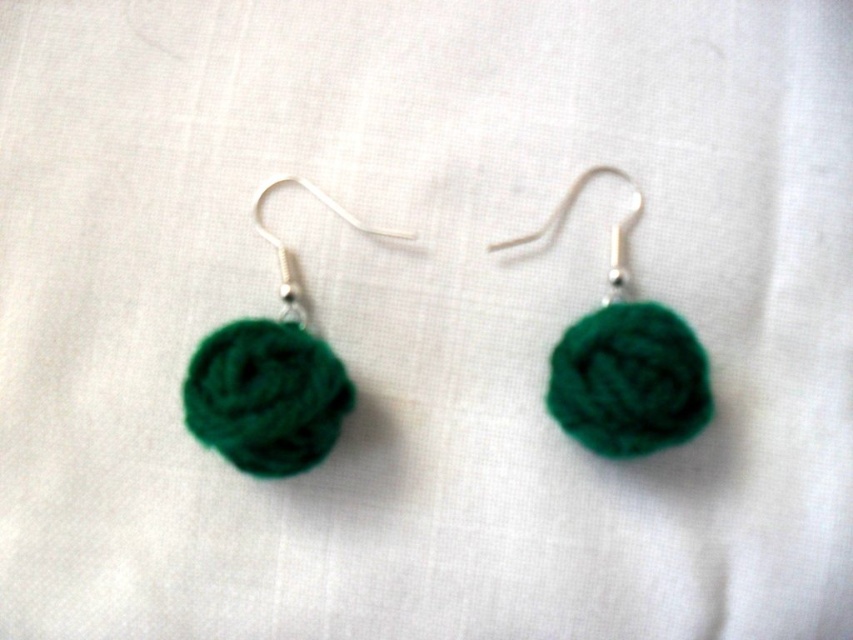
You are a jewelry designer who wants to place both the emerald green felt ball at left and the green fuzzy ball at center onto a display board. The display board has a maximum width of 30 centimeters. Can both items fit side by side on the board without overlapping?

The emerald green felt ball at left and green fuzzy ball at center are 35.72 centimeters apart. Since the distance between them is greater than the display board width of 30 centimeters, they cannot fit side by side without overlapping.

You are a jewelry designer who wants to create a pair of earrings with one earring significantly taller than the other. Looking at the image, which earring is taller between the emerald green felt ball at left and the green fuzzy ball at center?

The emerald green felt ball at left is much taller than the green fuzzy ball at center.